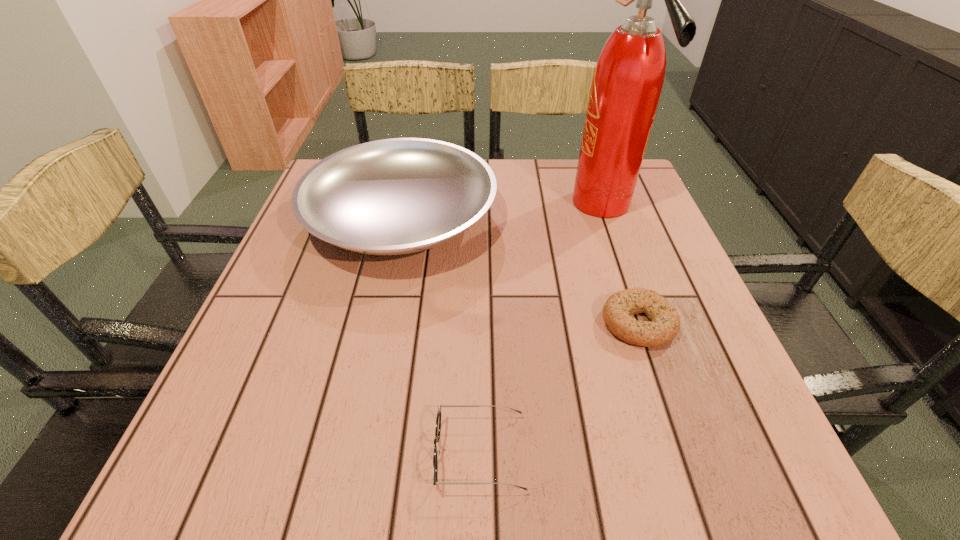
This screenshot has height=540, width=960. I want to click on fire extinguisher, so click(627, 82).

Image resolution: width=960 pixels, height=540 pixels. I want to click on the third shortest object, so click(395, 196).

Locate an element on the screen. the second nearest object is located at coordinates (665, 324).

You are a GUI agent. You are given a task and a screenshot of the screen. Output one action in this format:
    pyautogui.click(x=<x>, y=<y>)
    Task: Click on the spectacles
    The width and height of the screenshot is (960, 540).
    Given the screenshot: What is the action you would take?
    pyautogui.click(x=438, y=420)

I want to click on free space located on the front of the tallest object, so click(x=639, y=313).

I want to click on blank area located 0.370m on the front of the bedpan, so click(x=349, y=458).

This screenshot has width=960, height=540. In order to click on free space located on the back of the third farthest object in this screenshot , I will do `click(612, 245)`.

At what (x,y) coordinates should I click in order to perform the action: click on vacant region located through the lenses of the nearest object. Please return your answer as a coordinate pair (x, y). Image resolution: width=960 pixels, height=540 pixels. Looking at the image, I should click on (270, 453).

Find the location of a particular element. The image size is (960, 540). vacant space located 0.100m through the lenses of the nearest object is located at coordinates (370, 453).

Locate an element on the screen. The width and height of the screenshot is (960, 540). vacant space located through the lenses of the nearest object is located at coordinates (256, 453).